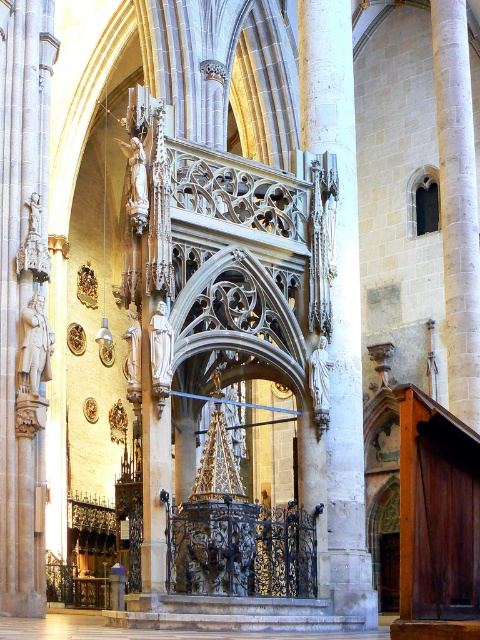
Question: Does polished stone statue at left appear over white stone column at center?

Choices:
 (A) yes
 (B) no

Answer: (B)

Question: Which of these objects is positioned farthest from the polished stone statue at left?

Choices:
 (A) white marble statue at right
 (B) polished bronze statue at left
 (C) white stone column at center

Answer: (A)

Question: Can you confirm if polished bronze statue at left is bigger than white marble statue at right?

Choices:
 (A) no
 (B) yes

Answer: (A)

Question: Which of the following is the farthest from the observer?

Choices:
 (A) white stone column at center
 (B) polished stone statue at left
 (C) white marble statue at right

Answer: (C)

Question: Which of the following is the farthest from the observer?

Choices:
 (A) (2, 579)
 (B) (346, 609)
 (C) (320, 364)

Answer: (B)

Question: Does polished stone statue at left have a greater width compared to polished bronze statue at left?

Choices:
 (A) yes
 (B) no

Answer: (A)